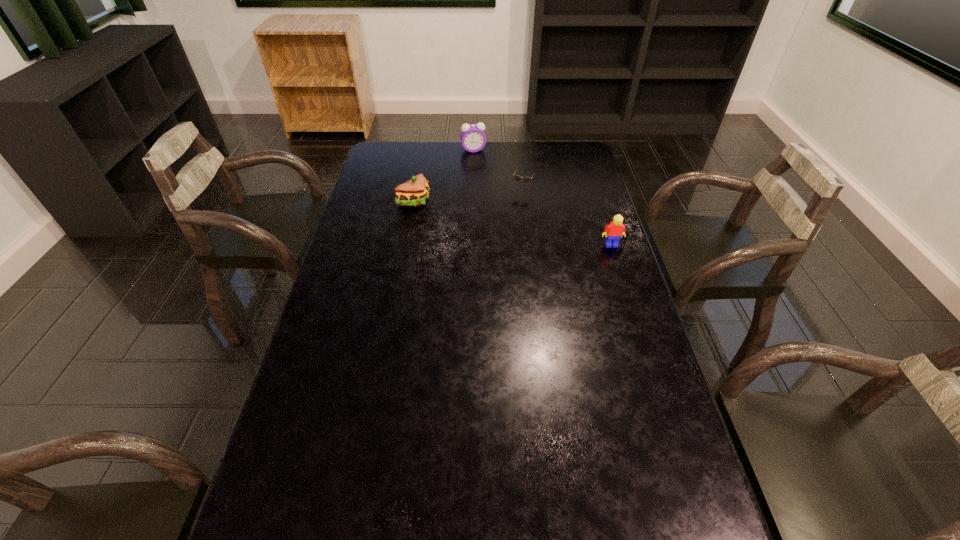
You are a GUI agent. You are given a task and a screenshot of the screen. Output one action in this format:
    pyautogui.click(x=<x>, y=<y>)
    Task: Click on the sandwich
    The width and height of the screenshot is (960, 540).
    Given the screenshot: What is the action you would take?
    pyautogui.click(x=414, y=192)

This screenshot has height=540, width=960. Find the location of `Lego`. Lego is located at coordinates (615, 230).

Find the location of a particular element. Image resolution: width=960 pixels, height=540 pixels. the nearest object is located at coordinates (615, 230).

Where is `the third object from right to left`? the third object from right to left is located at coordinates (473, 138).

Where is `the farthest object`? The height and width of the screenshot is (540, 960). the farthest object is located at coordinates (473, 138).

The image size is (960, 540). I want to click on the third object from left to right, so [x=526, y=179].

I want to click on sunglasses, so click(526, 179).

You are a GUI agent. You are given a task and a screenshot of the screen. Output one action in this format:
    pyautogui.click(x=<x>, y=<y>)
    Task: Click on the vacant point located 0.140m on the front of the leftmost object
    This screenshot has height=540, width=960.
    Given the screenshot: What is the action you would take?
    pyautogui.click(x=408, y=237)

The height and width of the screenshot is (540, 960). Find the location of `free space located on the front-facing side of the nearest object`. free space located on the front-facing side of the nearest object is located at coordinates (626, 289).

The height and width of the screenshot is (540, 960). I want to click on vacant region located 0.090m on the face of the alarm clock, so click(478, 164).